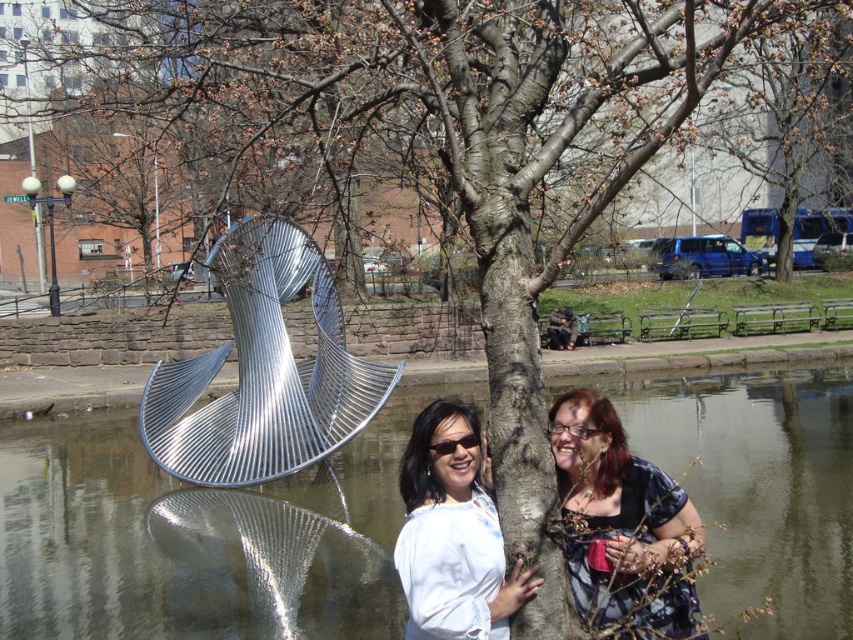
Question: Which object appears closest to the camera in this image?

Choices:
 (A) metallic water at center
 (B) metallic silver sculpture at center
 (C) white matte shirt at center

Answer: (C)

Question: Is metallic water at center further to the viewer compared to white matte shirt at center?

Choices:
 (A) yes
 (B) no

Answer: (A)

Question: Which point appears farthest from the camera in this image?

Choices:
 (A) (590, 454)
 (B) (345, 369)

Answer: (B)

Question: Does metallic water at center have a lesser width compared to metallic silver sculpture at center?

Choices:
 (A) no
 (B) yes

Answer: (A)

Question: Is metallic silver sculpture at center to the right of patterned fabric dress at center from the viewer's perspective?

Choices:
 (A) yes
 (B) no

Answer: (B)

Question: Which point is closer to the camera taking this photo?

Choices:
 (A) (392, 385)
 (B) (654, 406)

Answer: (A)